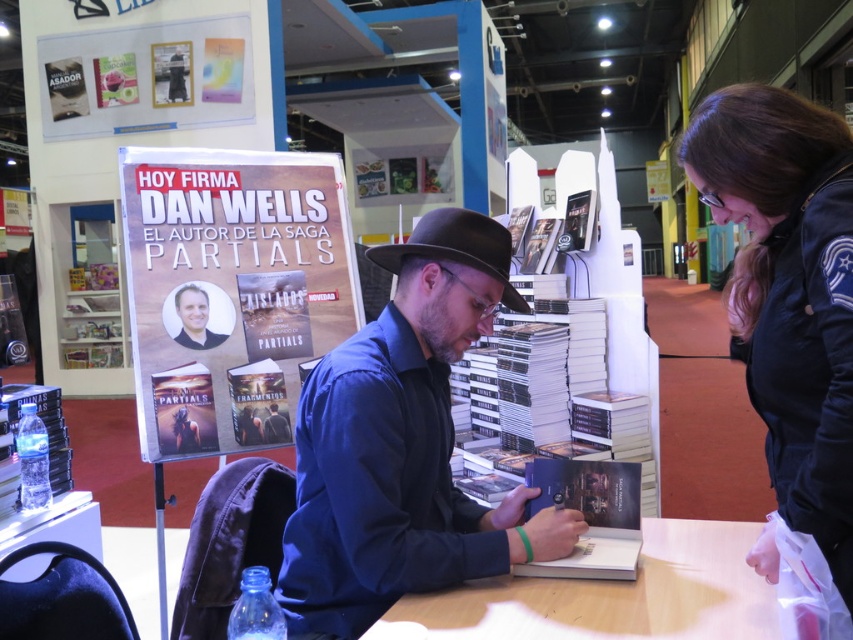
Is matte paper posters at upper left below hardcover book at center?

Actually, matte paper posters at upper left is above hardcover book at center.

Who is more distant from viewer, (x=96, y=84) or (x=596, y=554)?

The point (x=96, y=84) is more distant.

Consider the image. Who is more distant from viewer, (61, 80) or (555, 563)?

Point (61, 80)

You are a GUI agent. You are given a task and a screenshot of the screen. Output one action in this format:
    pyautogui.click(x=<x>, y=<y>)
    Task: Click on the matte paper posters at upper left
    This screenshot has height=640, width=853.
    Given the screenshot: What is the action you would take?
    pyautogui.click(x=146, y=77)

Who is positioned more to the left, blue cotton shirt at center or black felt fedora at center?

Positioned to the left is blue cotton shirt at center.

Who is shorter, blue cotton shirt at center or black felt fedora at center?

black felt fedora at center is shorter.

Does point (438, 584) come in front of point (461, 211)?

Yes, it is.

You are a GUI agent. You are given a task and a screenshot of the screen. Output one action in this format:
    pyautogui.click(x=<x>, y=<y>)
    Task: Click on the blue cotton shirt at center
    This screenshot has height=640, width=853.
    Given the screenshot: What is the action you would take?
    pyautogui.click(x=403, y=444)

Which is behind, point (381, 544) or point (532, 566)?

The point (532, 566) is more distant.

Locate an element on the screen. This screenshot has width=853, height=640. blue cotton shirt at center is located at coordinates (403, 444).